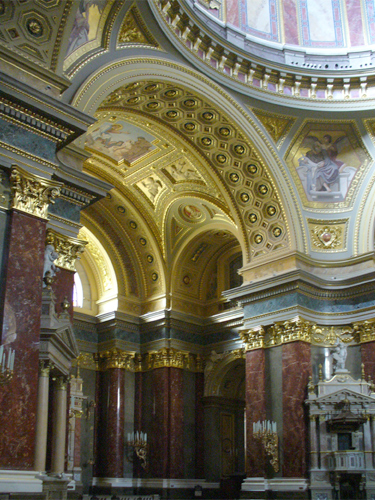
Where is `white candles on candalabras`? The height and width of the screenshot is (500, 375). white candles on candalabras is located at coordinates (135, 434), (255, 428), (258, 427), (263, 427), (270, 426), (275, 427), (130, 436), (140, 435), (145, 437).